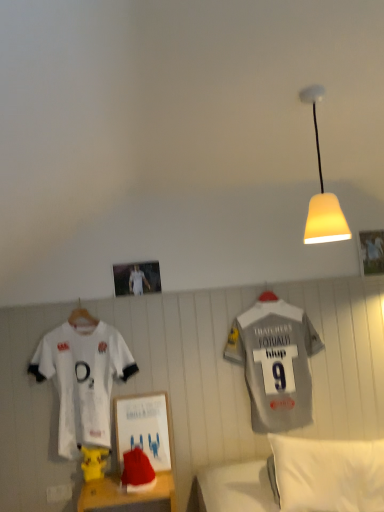
Question: Can you confirm if yellow matte lampshade at upper right is bigger than metallic silver photo frame at upper center, arranged as the second picture frame when viewed from the right?

Choices:
 (A) yes
 (B) no

Answer: (A)

Question: Is yellow matte lampshade at upper right smaller than metallic silver photo frame at upper center, arranged as the second picture frame when viewed from the right?

Choices:
 (A) no
 (B) yes

Answer: (A)

Question: Does yellow matte lampshade at upper right have a greater height compared to metallic silver photo frame at upper center, the first picture frame from the left?

Choices:
 (A) yes
 (B) no

Answer: (A)

Question: Is metallic silver photo frame at upper center, which ranks as the first picture frame in front-to-back order, inside yellow matte lampshade at upper right?

Choices:
 (A) no
 (B) yes

Answer: (A)

Question: Does yellow matte lampshade at upper right appear on the left side of metallic silver photo frame at upper center, arranged as the second picture frame when viewed from the right?

Choices:
 (A) yes
 (B) no

Answer: (B)

Question: Considering the positions of yellow matte lampshade at upper right and metallic silver photo frame at upper center, acting as the second picture frame starting from the back, in the image, is yellow matte lampshade at upper right bigger or smaller than metallic silver photo frame at upper center, acting as the second picture frame starting from the back,?

Choices:
 (A) small
 (B) big

Answer: (B)

Question: Does point (311, 89) appear closer or farther from the camera than point (137, 265)?

Choices:
 (A) closer
 (B) farther

Answer: (A)

Question: From a real-world perspective, is yellow matte lampshade at upper right physically located above or below metallic silver photo frame at upper center, acting as the second picture frame starting from the back?

Choices:
 (A) above
 (B) below

Answer: (A)

Question: In terms of width, does yellow matte lampshade at upper right look wider or thinner when compared to metallic silver photo frame at upper center, which ranks as the first picture frame in front-to-back order?

Choices:
 (A) thin
 (B) wide

Answer: (B)

Question: From the image's perspective, relative to gray fabric sports uniform at right, which is the first sports uniform in right-to-left order, is metallic silver photo frame at upper center, acting as the second picture frame starting from the back, above or below?

Choices:
 (A) below
 (B) above

Answer: (B)

Question: Does point (155, 286) appear closer or farther from the camera than point (296, 404)?

Choices:
 (A) farther
 (B) closer

Answer: (B)

Question: From a real-world perspective, is metallic silver photo frame at upper center, which ranks as the first picture frame in front-to-back order, physically located above or below gray fabric sports uniform at right, which is the first sports uniform in right-to-left order?

Choices:
 (A) below
 (B) above

Answer: (B)

Question: Considering their positions, is metallic silver photo frame at upper center, acting as the second picture frame starting from the back, located in front of or behind gray fabric sports uniform at right, which is the first sports uniform in right-to-left order?

Choices:
 (A) behind
 (B) front

Answer: (A)

Question: Would you say wooden picture frame at upper right, marked as the second picture frame in a front-to-back arrangement, is to the left or to the right of yellow matte lampshade at upper right in the picture?

Choices:
 (A) left
 (B) right

Answer: (B)

Question: In terms of size, does wooden picture frame at upper right, the first picture frame viewed from the back, appear bigger or smaller than yellow matte lampshade at upper right?

Choices:
 (A) big
 (B) small

Answer: (B)